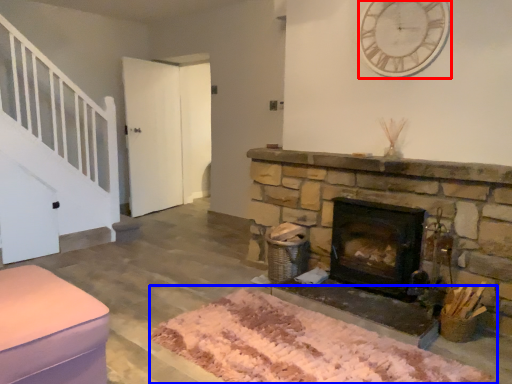
Question: Which point is closer to the camera, clock (highlighted by a red box) or mat (highlighted by a blue box)?

Choices:
 (A) clock
 (B) mat

Answer: (B)